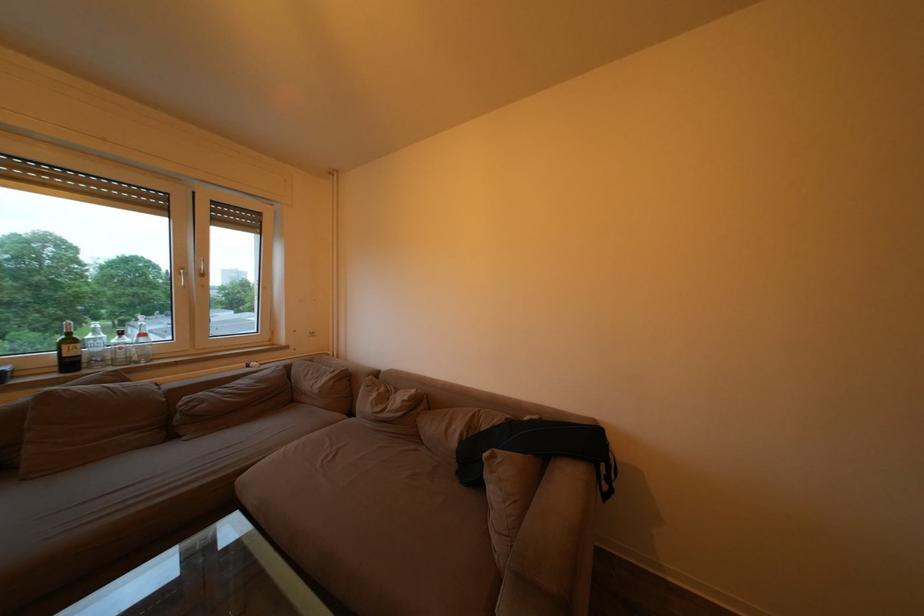
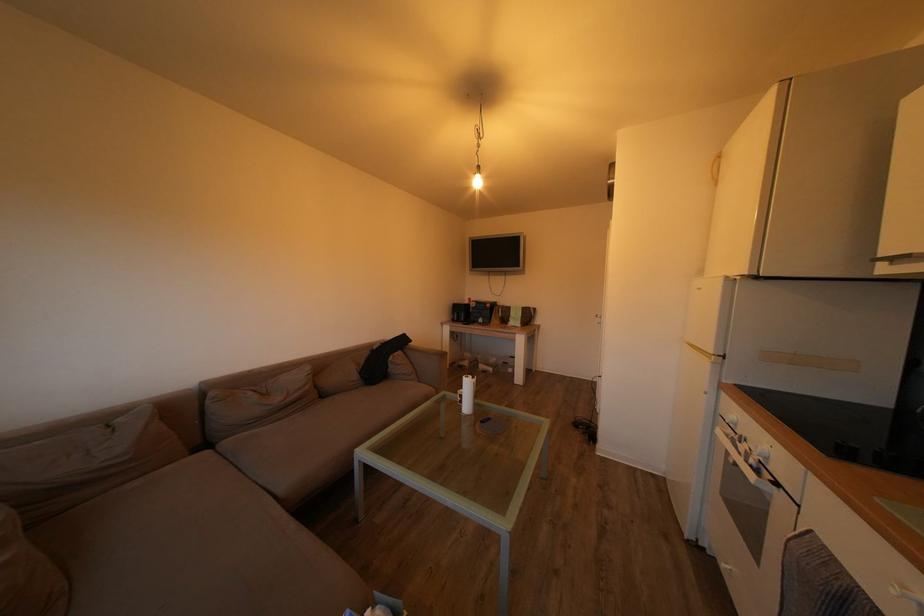
In the second image, find the point that corresponds to the point at 463,448 in the first image.

(362, 382)